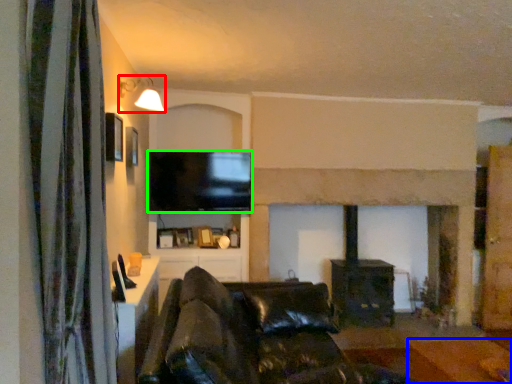
Question: Estimate the real-world distances between objects in this image. Which object is closer to light fixture (highlighted by a red box), furniture (highlighted by a blue box) or television (highlighted by a green box)?

Choices:
 (A) furniture
 (B) television

Answer: (B)